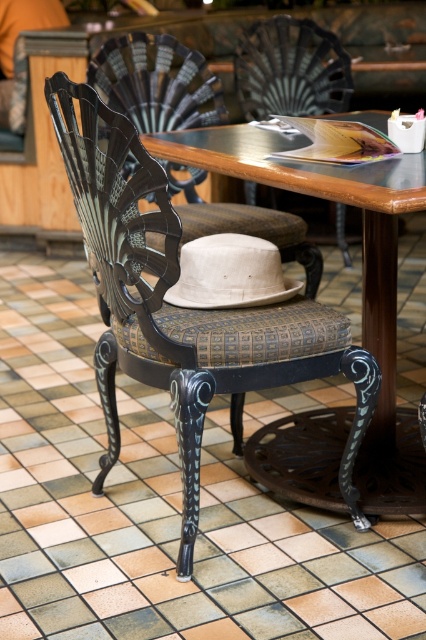
You are a customer entering the cozy cafe and see the matte black chair at center and the matte black chair at upper center. Which chair is positioned lower in the image?

The matte black chair at center is positioned below the matte black chair at upper center, so it is lower in the image.

You are a customer entering the cozy cafe and want to sit down at the wooden table at center. Which side of the matte black chair at center should you walk around to reach the table?

You should walk around the right side of the matte black chair at center to reach the wooden table at center since the table is positioned to the right of the chair.